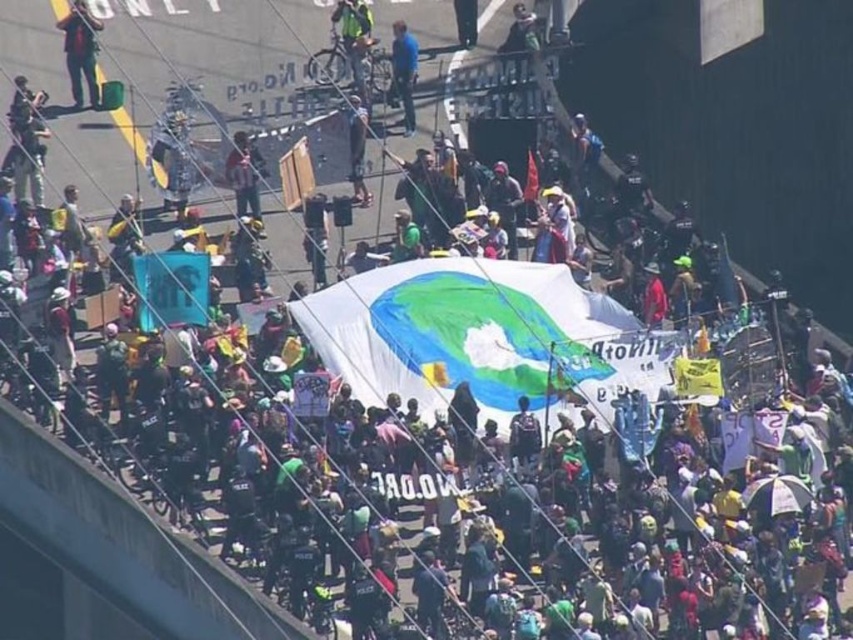
Question: In this image, where is striped shirt at center located relative to blue fabric at center?

Choices:
 (A) left
 (B) right

Answer: (A)

Question: Does striped shirt at center have a larger size compared to blue fabric at center?

Choices:
 (A) yes
 (B) no

Answer: (A)

Question: Which point is closer to the camera?

Choices:
 (A) striped shirt at center
 (B) matte black pants at upper left

Answer: (A)

Question: Which of these objects is positioned farthest from the blue fabric at center?

Choices:
 (A) matte black pants at upper left
 (B) striped shirt at center

Answer: (A)

Question: Can you confirm if striped shirt at center is bigger than blue fabric at center?

Choices:
 (A) yes
 (B) no

Answer: (A)

Question: Which is farther from the blue fabric at center?

Choices:
 (A) matte black pants at upper left
 (B) striped shirt at center

Answer: (A)